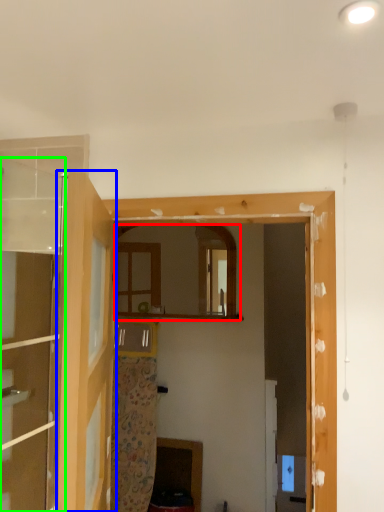
Question: Which is farther away from mirror (highlighted by a red box)? door (highlighted by a blue box) or door (highlighted by a green box)?

Choices:
 (A) door
 (B) door

Answer: (A)